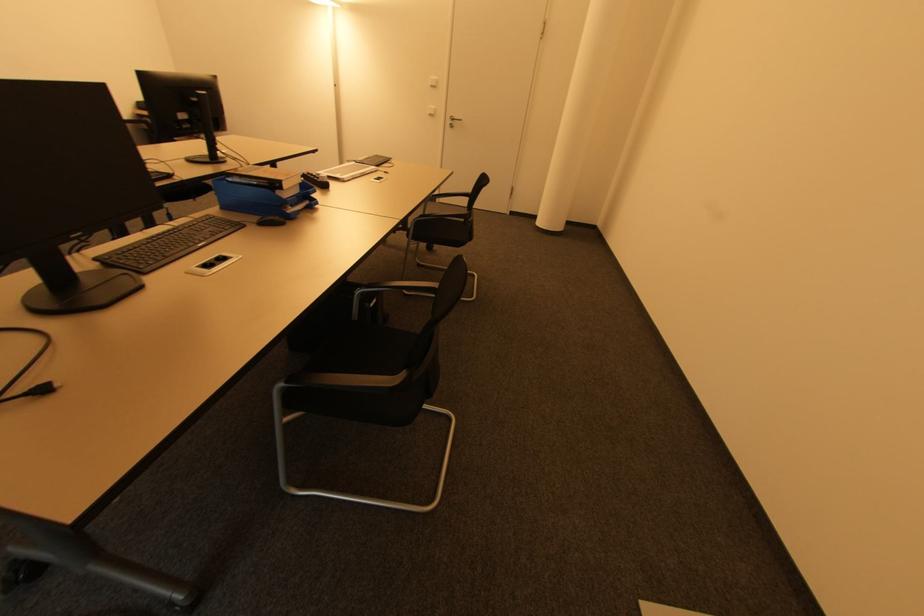
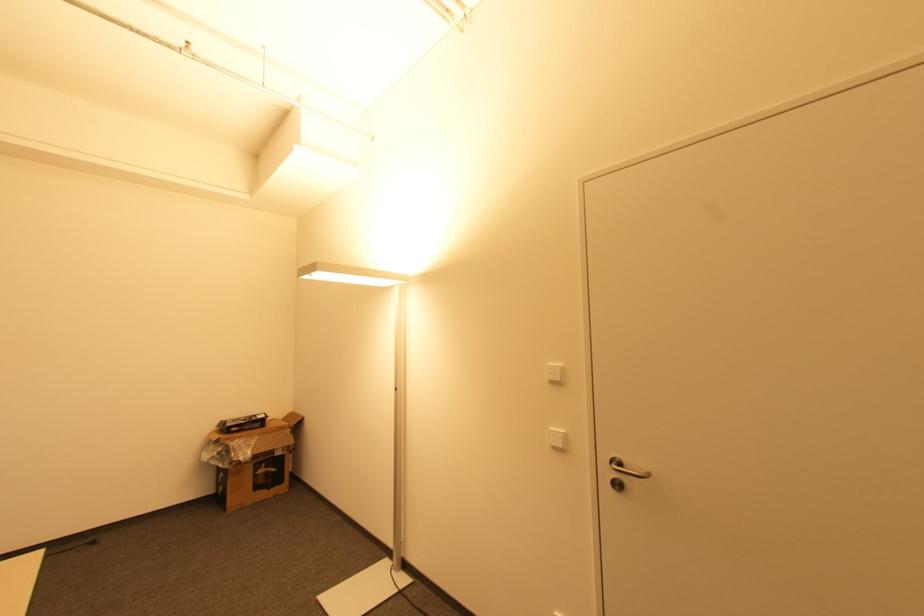
Where in the second image is the point corresponding to the point at 434,87 from the first image?

(554, 383)